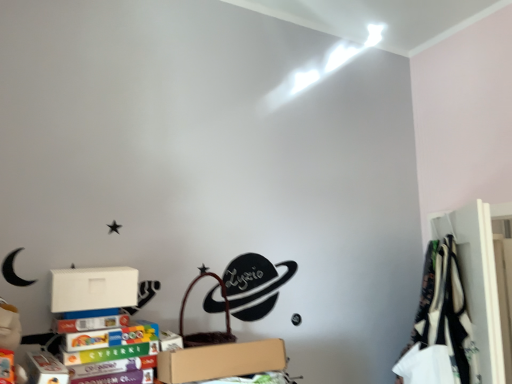
Question: From the image's perspective, relative to white matte cardboard box at lower left, is brown cardboard box at lower center above or below?

Choices:
 (A) above
 (B) below

Answer: (B)

Question: Is brown cardboard box at lower center wider or thinner than white matte cardboard box at lower left?

Choices:
 (A) wide
 (B) thin

Answer: (A)

Question: Considering the real-world distances, which object is closest to the white fabric at right?

Choices:
 (A) brown cardboard box at lower center
 (B) white matte cardboard box at lower left

Answer: (A)

Question: Which of these objects is positioned closest to the brown cardboard box at lower center?

Choices:
 (A) white fabric at right
 (B) white matte cardboard box at lower left

Answer: (B)